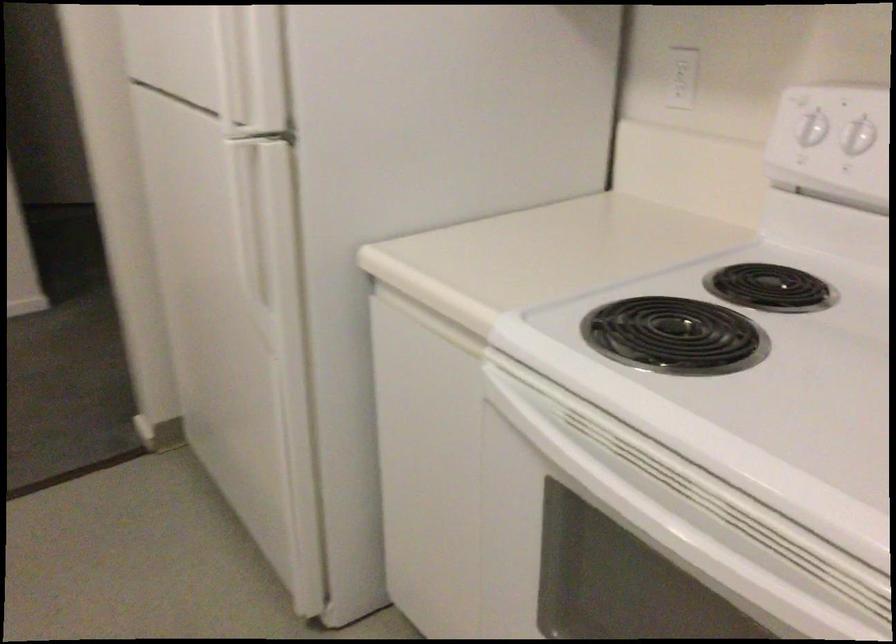
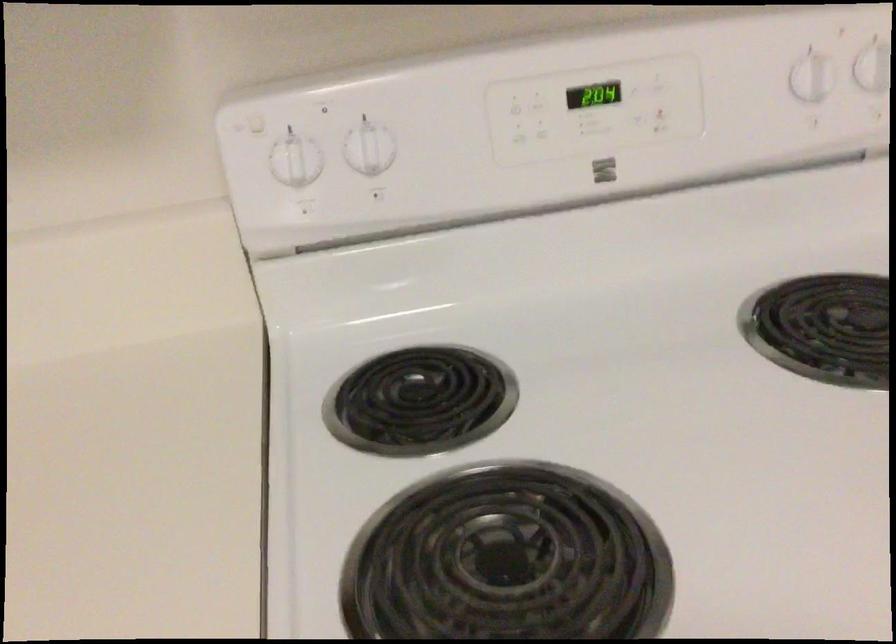
Question: The camera is either moving clockwise (left) or counter-clockwise (right) around the object. The first image is from the beginning of the video and the second image is from the end. Is the camera moving left or right when shooting the video?

Choices:
 (A) Left
 (B) Right

Answer: (A)